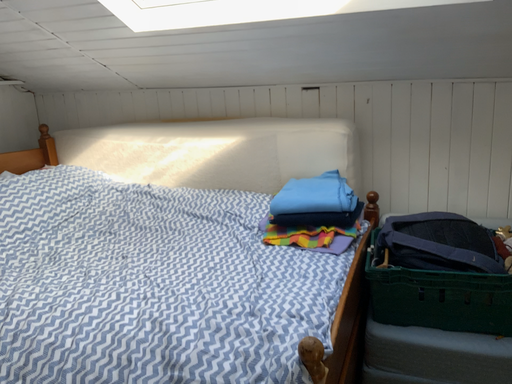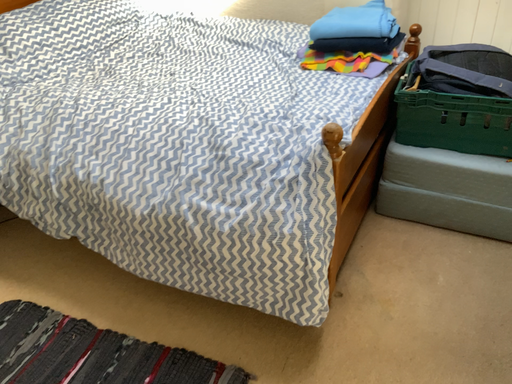
Question: Which way did the camera rotate in the video?

Choices:
 (A) rotated upward
 (B) rotated downward

Answer: (B)